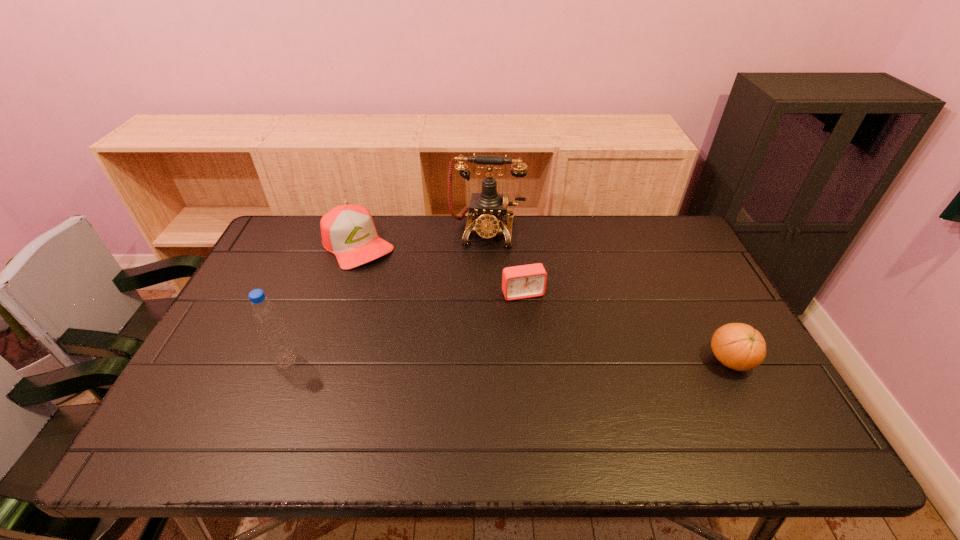
Where is `free spot located 0.350m on the front-facing side of the baseball cap`? The width and height of the screenshot is (960, 540). free spot located 0.350m on the front-facing side of the baseball cap is located at coordinates (436, 330).

You are a GUI agent. You are given a task and a screenshot of the screen. Output one action in this format:
    pyautogui.click(x=<x>, y=<y>)
    Task: Click on the blank area located 0.210m on the front-facing side of the shortest object
    This screenshot has width=960, height=540.
    Given the screenshot: What is the action you would take?
    pyautogui.click(x=550, y=360)

The height and width of the screenshot is (540, 960). In order to click on vacant area located 0.210m on the front-facing side of the shortest object in this screenshot , I will do `click(550, 360)`.

Identify the location of vacant space situated on the front-facing side of the shortest object. (569, 407).

This screenshot has height=540, width=960. I want to click on blank space located on the front of the telephone, featuring the rotary dial, so click(x=471, y=336).

The height and width of the screenshot is (540, 960). In order to click on vacant region located 0.200m on the front of the telephone, featuring the rotary dial in this screenshot , I will do `click(477, 292)`.

You are a GUI agent. You are given a task and a screenshot of the screen. Output one action in this format:
    pyautogui.click(x=<x>, y=<y>)
    Task: Click on the vacant space situated 0.220m on the front of the telephone, featuring the rotary dial
    This screenshot has width=960, height=540.
    Given the screenshot: What is the action you would take?
    pyautogui.click(x=476, y=297)

What are the coordinates of `baseball cap located in the far edge section of the desktop` in the screenshot? It's located at (348, 231).

Where is `telephone that is at the far edge`? The width and height of the screenshot is (960, 540). telephone that is at the far edge is located at coordinates (489, 207).

The height and width of the screenshot is (540, 960). Find the location of `object at the right edge`. object at the right edge is located at coordinates (738, 346).